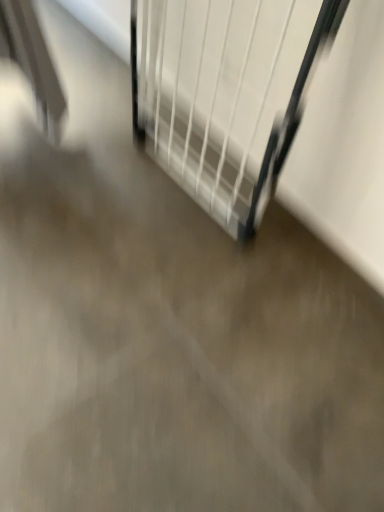
Locate an element on the screen. This screenshot has width=384, height=512. white plastic radiator at center is located at coordinates (225, 93).

What is the approximate width of white plastic radiator at center?

white plastic radiator at center is 9.67 inches in width.

What do you see at coordinates (225, 93) in the screenshot?
I see `white plastic radiator at center` at bounding box center [225, 93].

You are a GUI agent. You are given a task and a screenshot of the screen. Output one action in this format:
    pyautogui.click(x=<x>, y=<y>)
    Task: Click on the white plastic radiator at center
    Image resolution: width=384 pixels, height=512 pixels.
    Given the screenshot: What is the action you would take?
    pyautogui.click(x=225, y=93)